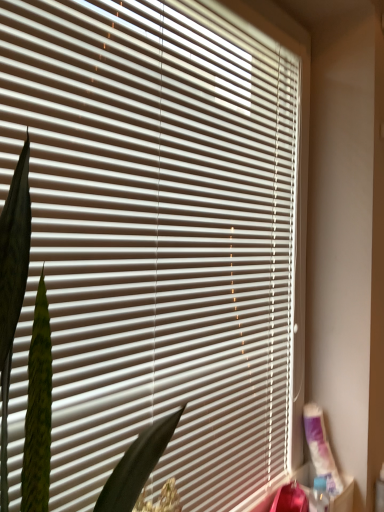
In order to face plastic/textured container at lower right, should I rotate leftwards or rightwards?

To align with it, rotate right about 17.121°.

What do you see at coordinates (343, 496) in the screenshot? This screenshot has height=512, width=384. I see `plastic/textured container at lower right` at bounding box center [343, 496].

Locate an element on the screen. The height and width of the screenshot is (512, 384). plastic/textured container at lower right is located at coordinates (343, 496).

At what (x,y) coordinates should I click in order to perform the action: click on plastic/textured container at lower right. Please return your answer as a coordinate pair (x, y). The height and width of the screenshot is (512, 384). Looking at the image, I should click on (343, 496).